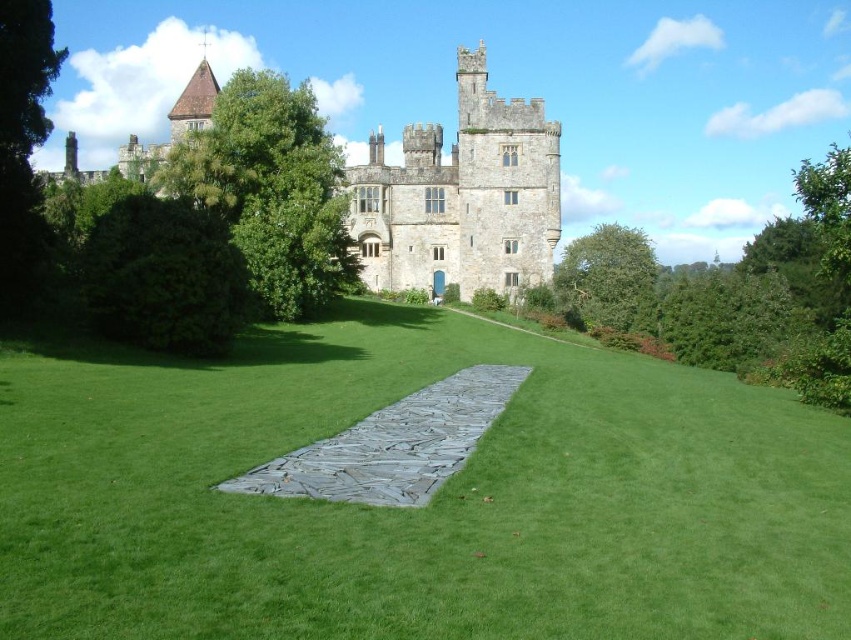
Is the position of green grass at center more distant than that of gray stone path at center?

No, green grass at center is in front of gray stone path at center.

Is green grass at center below gray stone path at center?

Yes.

Where is `green grass at center`? The width and height of the screenshot is (851, 640). green grass at center is located at coordinates (418, 508).

This screenshot has width=851, height=640. Find the location of `green grass at center`. green grass at center is located at coordinates pyautogui.click(x=418, y=508).

Between green grass at center and stone castle at center, which one is positioned lower?

green grass at center

Can you confirm if green grass at center is positioned above stone castle at center?

Actually, green grass at center is below stone castle at center.

Does point (504, 356) come in front of point (424, 138)?

Yes, point (504, 356) is in front of point (424, 138).

In order to click on green grass at center in this screenshot , I will do `click(418, 508)`.

Is stone castle at center thinner than gray stone path at center?

In fact, stone castle at center might be wider than gray stone path at center.

Is stone castle at center taller than gray stone path at center?

Indeed, stone castle at center has a greater height compared to gray stone path at center.

Find the location of a particular element. The width and height of the screenshot is (851, 640). stone castle at center is located at coordinates (461, 196).